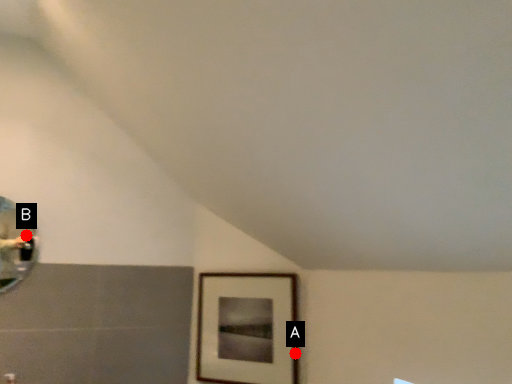
Question: Two points are circled on the image, labeled by A and B beside each circle. Among these points, which one is farthest from the camera?

Choices:
 (A) A is further
 (B) B is further

Answer: (A)